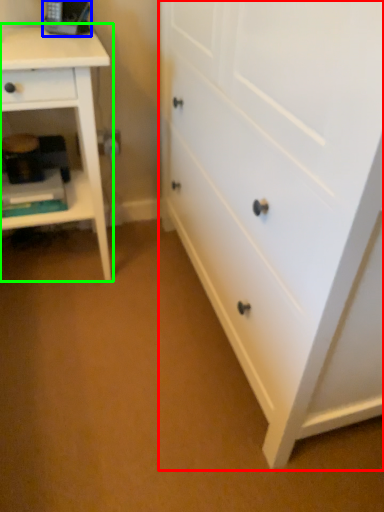
Question: Which is nearer to the chest of drawers (highlighted by a red box)? equipment (highlighted by a blue box) or nightstand (highlighted by a green box).

Choices:
 (A) equipment
 (B) nightstand

Answer: (B)